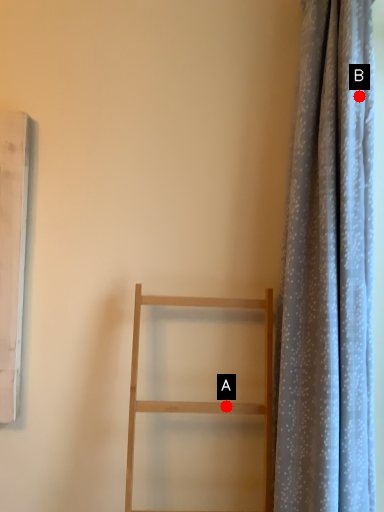
Question: Two points are circled on the image, labeled by A and B beside each circle. Which point is closer to the camera taking this photo?

Choices:
 (A) A is closer
 (B) B is closer

Answer: (B)